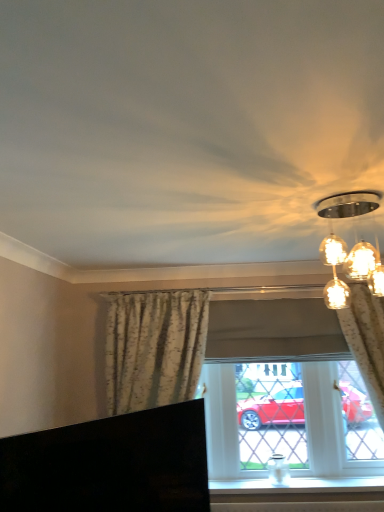
Identify the location of matte glass light fixture at upper right. (345, 268).

This screenshot has height=512, width=384. What do you see at coordinates (274, 331) in the screenshot? I see `matte floral curtains at center` at bounding box center [274, 331].

At what (x,y) coordinates should I click in order to perform the action: click on matte glass light fixture at upper right. Please return your answer as a coordinate pair (x, y). The height and width of the screenshot is (512, 384). Looking at the image, I should click on (345, 268).

Is matte floral curtains at center situated inside floral fabric curtain at center, which ranks as the 1th curtain in left-to-right order, or outside?

matte floral curtains at center is spatially situated outside floral fabric curtain at center, which ranks as the 1th curtain in left-to-right order.

Image resolution: width=384 pixels, height=512 pixels. I want to click on the 2nd curtain below when counting from the matte floral curtains at center (from the image's perspective), so click(x=154, y=348).

Is matte floral curtains at center positioned with its back to floral fabric curtain at center, which ranks as the 1th curtain in left-to-right order?

Yes.

Who is shorter, white smooth window sill at lower center or black glossy tv at lower left?

white smooth window sill at lower center.

Is white smooth window sill at lower center in contact with black glossy tv at lower left?

No.

Find the location of a particular element. furniture that appears above the white smooth window sill at lower center (from a real-world perspective) is located at coordinates (111, 464).

How many degrees apart are the facing directions of white smooth window sill at lower center and black glossy tv at lower left?

The facing directions of white smooth window sill at lower center and black glossy tv at lower left are 52.7 degrees apart.

Where is `lamp above the black glossy tv at lower left (from the image's perspective)`? The width and height of the screenshot is (384, 512). lamp above the black glossy tv at lower left (from the image's perspective) is located at coordinates click(x=345, y=268).

Based on the photo, from a real-world perspective, is black glossy tv at lower left on matte glass light fixture at upper right?

No, from a real-world perspective, black glossy tv at lower left is not over matte glass light fixture at upper right

Consider the image. Is black glossy tv at lower left closer to camera compared to matte glass light fixture at upper right?

Yes, black glossy tv at lower left is closer to the camera.

Considering the sizes of black glossy tv at lower left and matte glass light fixture at upper right in the image, is black glossy tv at lower left taller or shorter than matte glass light fixture at upper right?

Clearly, black glossy tv at lower left is taller compared to matte glass light fixture at upper right.

Considering the relative sizes of matte floral curtains at center and matte glass light fixture at upper right in the image provided, is matte floral curtains at center smaller than matte glass light fixture at upper right?

No, matte floral curtains at center is not smaller than matte glass light fixture at upper right.

In the scene shown: Would you say matte floral curtains at center is to the left or to the right of matte glass light fixture at upper right in the picture?

Based on their positions, matte floral curtains at center is located to the left of matte glass light fixture at upper right.

In terms of width, does matte floral curtains at center look wider or thinner when compared to matte glass light fixture at upper right?

Considering their sizes, matte floral curtains at center looks slimmer than matte glass light fixture at upper right.

Which is closer, (249, 303) or (348, 273)?

Clearly, point (249, 303) is more distant from the camera than point (348, 273).

Considering their positions, is black glossy tv at lower left located in front of or behind white smooth window sill at lower center?

Clearly, black glossy tv at lower left is in front of white smooth window sill at lower center.

Can you tell me how much black glossy tv at lower left and white smooth window sill at lower center differ in facing direction?

52.7 degrees separate the facing orientations of black glossy tv at lower left and white smooth window sill at lower center.

Can you confirm if black glossy tv at lower left is taller than white smooth window sill at lower center?

Indeed, black glossy tv at lower left has a greater height compared to white smooth window sill at lower center.

Looking at the image, does black glossy tv at lower left seem bigger or smaller compared to white smooth window sill at lower center?

Considering their sizes, black glossy tv at lower left takes up more space than white smooth window sill at lower center.

How far apart are floral fabric curtain at center, which ranks as the 1th curtain in left-to-right order, and floral fabric curtain at right, the 1th curtain when ordered from right to left?

The distance of floral fabric curtain at center, which ranks as the 1th curtain in left-to-right order, from floral fabric curtain at right, the 1th curtain when ordered from right to left, is 1.29 meters.

Could you tell me if floral fabric curtain at center, the 2th curtain in the right-to-left sequence, is facing floral fabric curtain at right, the 1th curtain when ordered from right to left?

No.

Is floral fabric curtain at right, which is the second curtain in left-to-right order, surrounded by floral fabric curtain at center, which ranks as the 1th curtain in left-to-right order?

No, floral fabric curtain at right, which is the second curtain in left-to-right order, is not a part of floral fabric curtain at center, which ranks as the 1th curtain in left-to-right order.

Find the location of a particular element. The height and width of the screenshot is (512, 384). curtain that appears above the floral fabric curtain at right, which is the second curtain in left-to-right order (from a real-world perspective) is located at coordinates (154, 348).

Find the location of `curtain on the left of white smooth window sill at lower center`. curtain on the left of white smooth window sill at lower center is located at coordinates (154, 348).

In the image, is floral fabric curtain at center, which ranks as the 1th curtain in left-to-right order, positioned in front of or behind white smooth window sill at lower center?

In the image, floral fabric curtain at center, which ranks as the 1th curtain in left-to-right order, appears in front of white smooth window sill at lower center.

From the picture: Do you think floral fabric curtain at center, which ranks as the 1th curtain in left-to-right order, is within white smooth window sill at lower center, or outside of it?

floral fabric curtain at center, which ranks as the 1th curtain in left-to-right order, is not enclosed by white smooth window sill at lower center.

Is floral fabric curtain at center, the 2th curtain in the right-to-left sequence, wider or thinner than white smooth window sill at lower center?

floral fabric curtain at center, the 2th curtain in the right-to-left sequence, is thinner than white smooth window sill at lower center.

The height and width of the screenshot is (512, 384). Find the location of `window that is above the floral fabric curtain at center, the 2th curtain in the right-to-left sequence (from a real-world perspective)`. window that is above the floral fabric curtain at center, the 2th curtain in the right-to-left sequence (from a real-world perspective) is located at coordinates (274, 331).

Where is `furniture above the white smooth window sill at lower center (from the image's perspective)`? furniture above the white smooth window sill at lower center (from the image's perspective) is located at coordinates (111, 464).

Estimate the real-world distances between objects in this image. Which object is closer to white smooth window sill at lower center, matte glass light fixture at upper right or floral fabric curtain at center, the 2th curtain in the right-to-left sequence?

floral fabric curtain at center, the 2th curtain in the right-to-left sequence, is positioned closer to the anchor white smooth window sill at lower center.

Considering their positions, is black glossy tv at lower left positioned closer to matte floral curtains at center than matte glass light fixture at upper right?

The object closer to matte floral curtains at center is black glossy tv at lower left.

When comparing their distances from black glossy tv at lower left, does floral fabric curtain at right, which is the second curtain in left-to-right order, or matte floral curtains at center seem closer?

matte floral curtains at center is closer to black glossy tv at lower left.

When comparing their distances from matte glass light fixture at upper right, does white smooth window sill at lower center or floral fabric curtain at right, the 1th curtain when ordered from right to left, seem closer?

floral fabric curtain at right, the 1th curtain when ordered from right to left, is closer to matte glass light fixture at upper right.

Based on their spatial positions, is floral fabric curtain at right, which is the second curtain in left-to-right order, or floral fabric curtain at center, the 2th curtain in the right-to-left sequence, closer to matte floral curtains at center?

Based on the image, floral fabric curtain at right, which is the second curtain in left-to-right order, appears to be nearer to matte floral curtains at center.

Which object lies nearer to the anchor point matte floral curtains at center, floral fabric curtain at center, which ranks as the 1th curtain in left-to-right order, or white smooth window sill at lower center?

Among the two, white smooth window sill at lower center is located nearer to matte floral curtains at center.

When comparing their distances from floral fabric curtain at right, which is the second curtain in left-to-right order, does white smooth window sill at lower center or matte floral curtains at center seem further?

white smooth window sill at lower center is positioned further to the anchor floral fabric curtain at right, which is the second curtain in left-to-right order.

Based on their spatial positions, is black glossy tv at lower left or white smooth window sill at lower center closer to matte glass light fixture at upper right?

black glossy tv at lower left is positioned closer to the anchor matte glass light fixture at upper right.

Find the location of a particular element. The width and height of the screenshot is (384, 512). window sill between black glossy tv at lower left and matte floral curtains at center in the front-back direction is located at coordinates (298, 485).

At what (x,y) coordinates should I click in order to perform the action: click on lamp between floral fabric curtain at center, which ranks as the 1th curtain in left-to-right order, and floral fabric curtain at right, which is the second curtain in left-to-right order, in the horizontal direction. Please return your answer as a coordinate pair (x, y). The image size is (384, 512). Looking at the image, I should click on (345, 268).

Find the location of a particular element. This screenshot has width=384, height=512. curtain between black glossy tv at lower left and floral fabric curtain at right, the 1th curtain when ordered from right to left is located at coordinates (154, 348).

Locate an element on the screen. Image resolution: width=384 pixels, height=512 pixels. window that lies between matte glass light fixture at upper right and white smooth window sill at lower center from top to bottom is located at coordinates (274, 331).